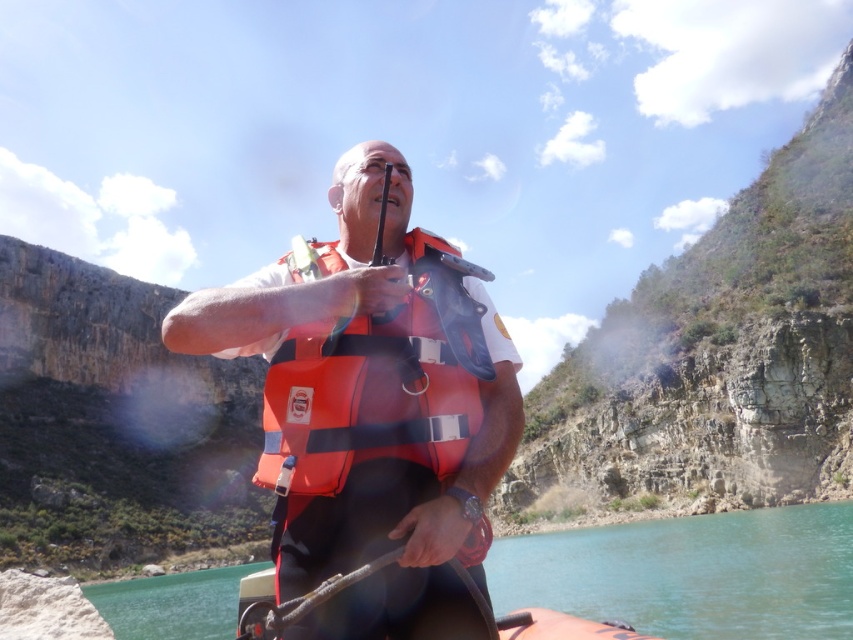
Question: Is orange life vest at center thinner than orange fabric life vest at center?

Choices:
 (A) yes
 (B) no

Answer: (B)

Question: Which point is closer to the camera taking this photo?

Choices:
 (A) 334,428
 (B) 469,323

Answer: (A)

Question: Is clear water at lower center in front of orange fabric life vest at center?

Choices:
 (A) yes
 (B) no

Answer: (B)

Question: Which point is farther to the camera?

Choices:
 (A) (311, 488)
 (B) (166, 616)

Answer: (B)

Question: Observing the image, what is the correct spatial positioning of orange life vest at center in reference to clear water at lower center?

Choices:
 (A) left
 (B) right

Answer: (B)

Question: Among these points, which one is farthest from the camera?

Choices:
 (A) (358, 355)
 (B) (376, 184)
 (C) (671, 522)

Answer: (C)